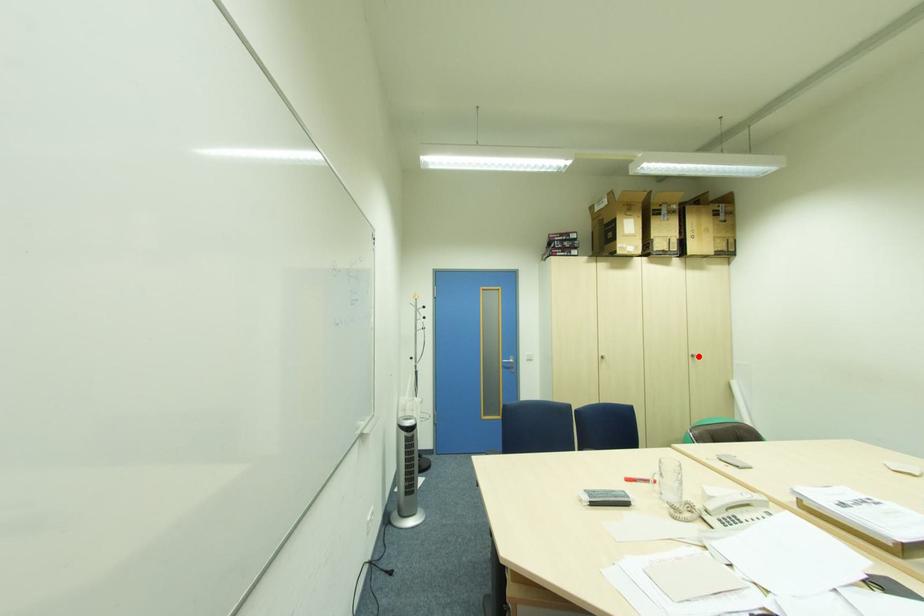
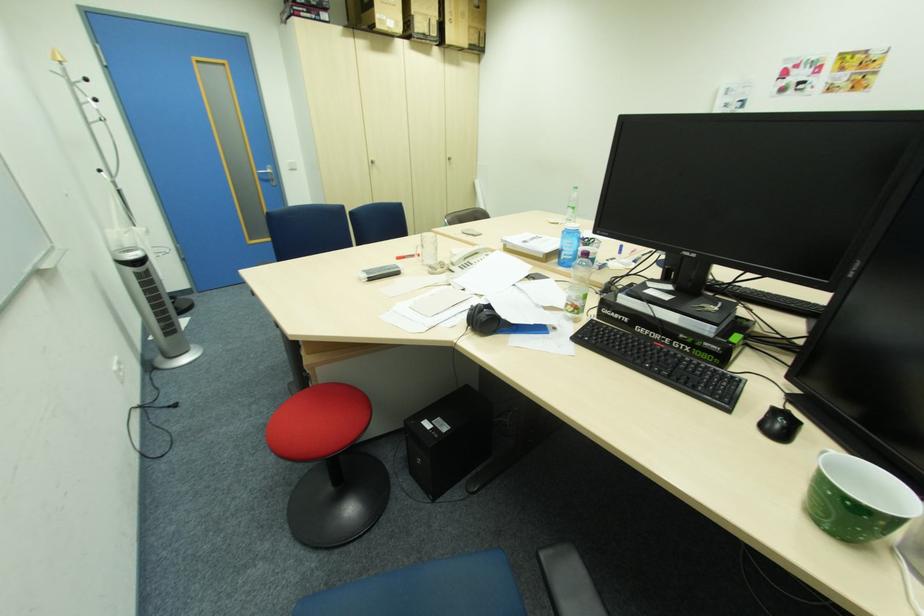
Locate, in the second image, the point that corresponds to the highlighted location in the first image.

(456, 159)